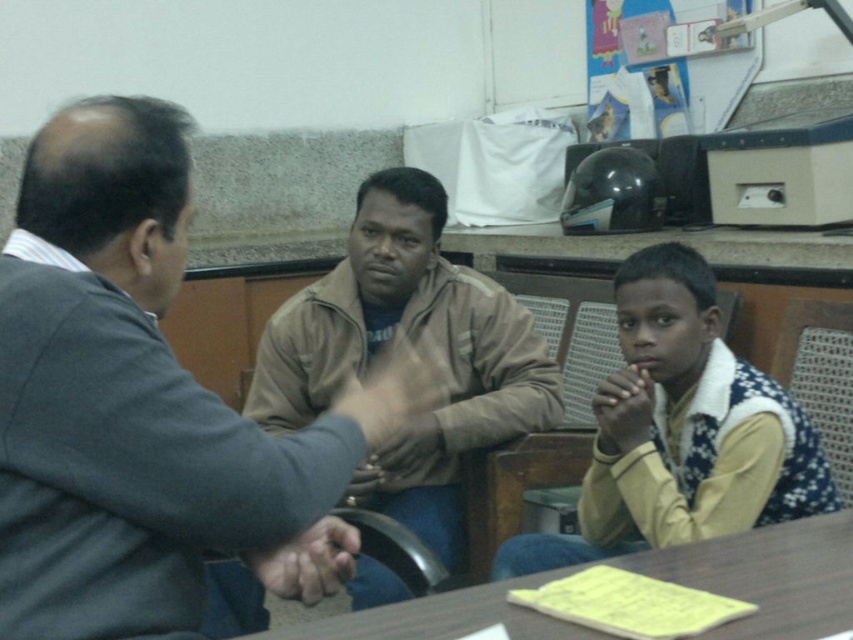
Who is taller, dark gray suit at center or dark brown leather hands at center?

dark gray suit at center is taller.

Can you confirm if dark gray suit at center is thinner than dark brown leather hands at center?

No, dark gray suit at center is not thinner than dark brown leather hands at center.

Which is behind, point (114, 282) or point (593, 412)?

Point (593, 412)

Where is `dark gray suit at center`? This screenshot has width=853, height=640. dark gray suit at center is located at coordinates (137, 397).

In the scene shown: Is dark gray suit at center to the left of dark skin hand at center from the viewer's perspective?

Indeed, dark gray suit at center is positioned on the left side of dark skin hand at center.

Is dark gray suit at center below dark skin hand at center?

Actually, dark gray suit at center is above dark skin hand at center.

Who is more distant from viewer, (x=292, y=531) or (x=264, y=568)?

The point (x=264, y=568) is behind.

Where is `dark gray suit at center`? Image resolution: width=853 pixels, height=640 pixels. dark gray suit at center is located at coordinates (137, 397).

Does brown leather jacket at center appear on the left side of yellow fleece vest at lower right?

Yes, brown leather jacket at center is to the left of yellow fleece vest at lower right.

Who is higher up, brown leather jacket at center or yellow fleece vest at lower right?

brown leather jacket at center is above.

In order to click on brown leather jacket at center in this screenshot , I will do click(413, 342).